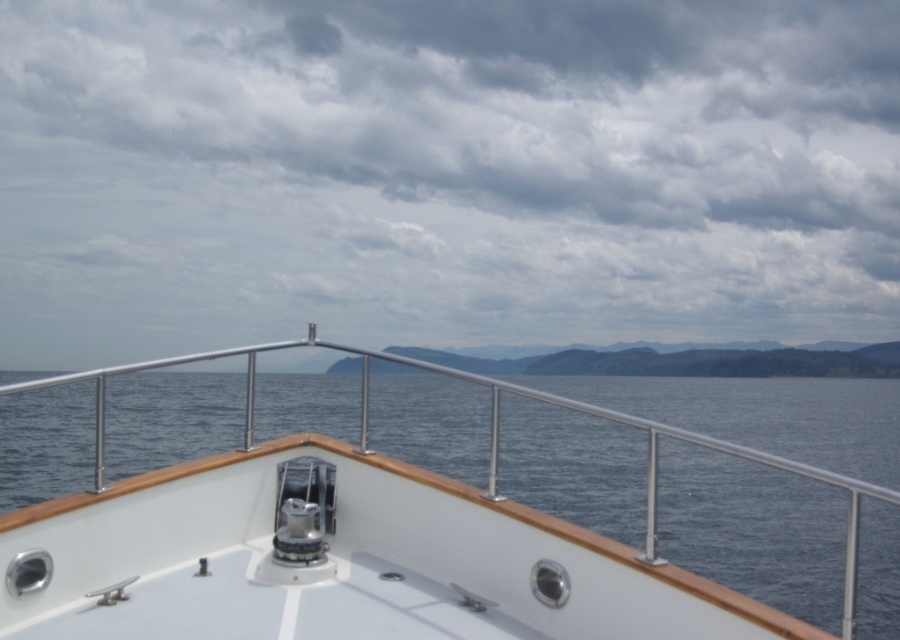
Question: Which point is farther from the camera taking this photo?

Choices:
 (A) (192, 45)
 (B) (330, 474)

Answer: (A)

Question: Is cloudy sky at upper center in front of white polished wood boat at center?

Choices:
 (A) yes
 (B) no

Answer: (B)

Question: Is cloudy sky at upper center wider than white polished wood boat at center?

Choices:
 (A) no
 (B) yes

Answer: (B)

Question: Can you confirm if cloudy sky at upper center is positioned below white polished wood boat at center?

Choices:
 (A) yes
 (B) no

Answer: (B)

Question: Which of the following is the farthest from the observer?

Choices:
 (A) (883, 29)
 (B) (603, 545)

Answer: (A)